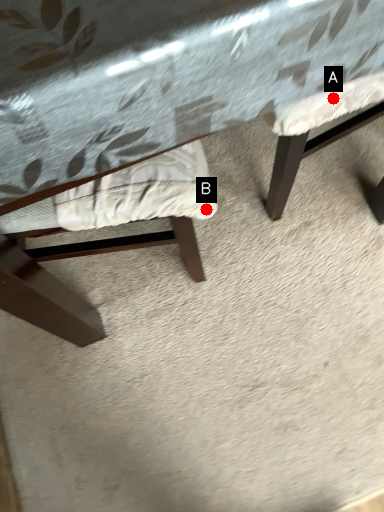
Question: Two points are circled on the image, labeled by A and B beside each circle. Which of the following is the closest to the observer?

Choices:
 (A) A is closer
 (B) B is closer

Answer: (A)